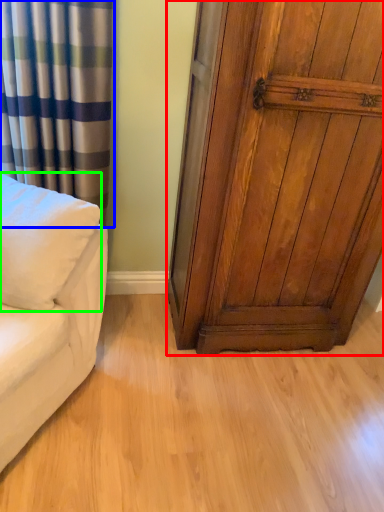
Question: Based on their relative distances, which object is farther from door (highlighted by a red box)? Choose from curtain (highlighted by a blue box) and pillow (highlighted by a green box).

Choices:
 (A) curtain
 (B) pillow

Answer: (B)